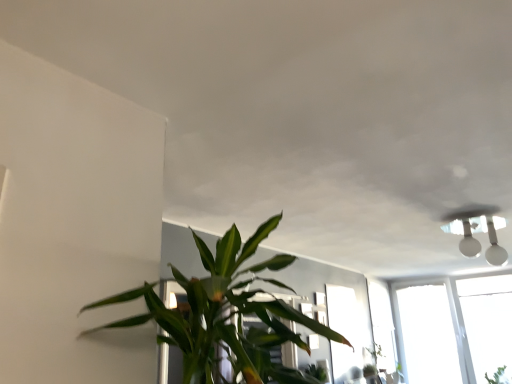
Question: From the image's perspective, is transparent glass window at center located beneath green leafy plant at center?

Choices:
 (A) yes
 (B) no

Answer: (A)

Question: Is transparent glass window at center with green leafy plant at center?

Choices:
 (A) no
 (B) yes

Answer: (A)

Question: Is transparent glass window at center shorter than green leafy plant at center?

Choices:
 (A) no
 (B) yes

Answer: (A)

Question: Does transparent glass window at center have a greater height compared to green leafy plant at center?

Choices:
 (A) no
 (B) yes

Answer: (B)

Question: Can you confirm if transparent glass window at center is wider than green leafy plant at center?

Choices:
 (A) yes
 (B) no

Answer: (B)

Question: Is transparent glass window at center taller or shorter than green leafy plant at center?

Choices:
 (A) tall
 (B) short

Answer: (A)

Question: From the image's perspective, is transparent glass window at center located above or below green leafy plant at center?

Choices:
 (A) above
 (B) below

Answer: (B)

Question: Relative to green leafy plant at center, is transparent glass window at center in front or behind?

Choices:
 (A) front
 (B) behind

Answer: (B)

Question: Looking at their shapes, would you say transparent glass window at center is wider or thinner than green leafy plant at center?

Choices:
 (A) wide
 (B) thin

Answer: (B)

Question: Is green leafy plant at center wider or thinner than green leafy plant at lower right?

Choices:
 (A) thin
 (B) wide

Answer: (B)

Question: Relative to green leafy plant at lower right, is green leafy plant at center in front or behind?

Choices:
 (A) front
 (B) behind

Answer: (A)

Question: Looking at the image, does green leafy plant at center seem bigger or smaller compared to green leafy plant at lower right?

Choices:
 (A) big
 (B) small

Answer: (A)

Question: From their relative heights in the image, would you say green leafy plant at center is taller or shorter than green leafy plant at lower right?

Choices:
 (A) tall
 (B) short

Answer: (A)

Question: From the image's perspective, is green leafy plant at lower right above or below green leafy plant at center?

Choices:
 (A) above
 (B) below

Answer: (B)

Question: Is green leafy plant at lower right inside or outside of green leafy plant at center?

Choices:
 (A) inside
 (B) outside

Answer: (B)